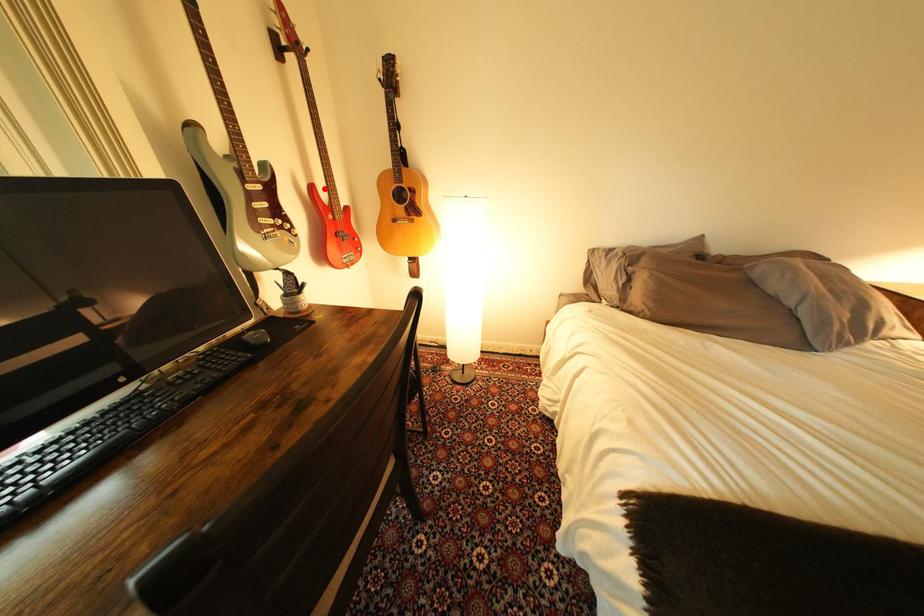
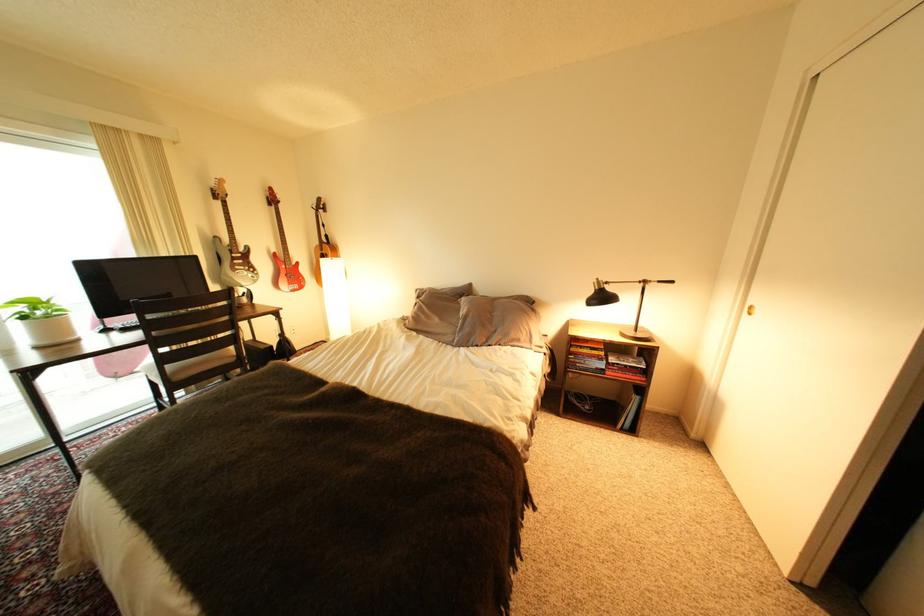
The point at the highlighted location is marked in the first image. Where is the corresponding point in the second image?

(286, 254)